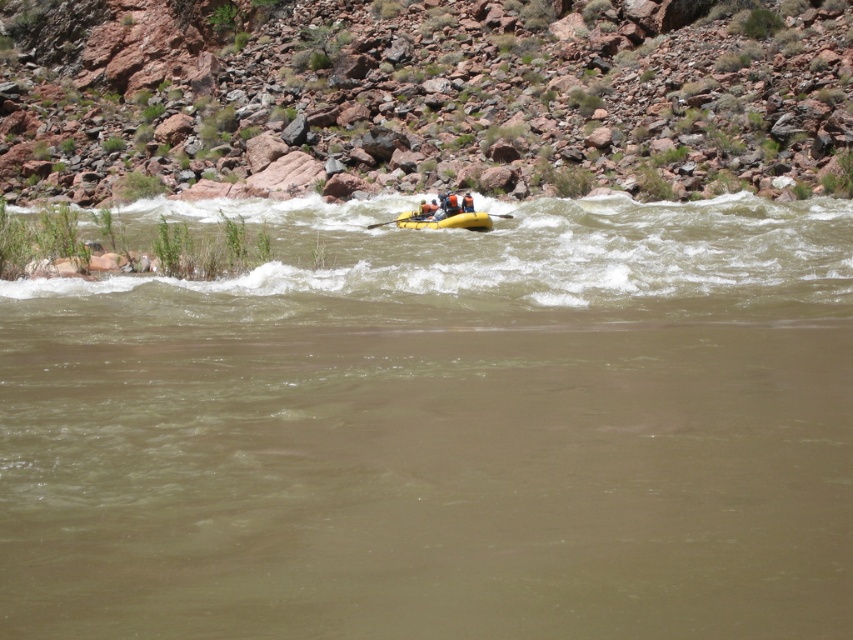
Is the position of yellow rubber boat at center less distant than that of yellow rubber paddle at center?

Yes.

Who is positioned more to the left, yellow rubber boat at center or yellow rubber paddle at center?

From the viewer's perspective, yellow rubber paddle at center appears more on the left side.

Which is in front, point (459, 221) or point (370, 224)?

Point (459, 221) is in front.

Image resolution: width=853 pixels, height=640 pixels. Find the location of `yellow rubber boat at center`. yellow rubber boat at center is located at coordinates (444, 218).

Which is below, brown rubber raft at center or orange life vest at center?

brown rubber raft at center is lower down.

Is point (846, 296) more distant than point (463, 209)?

No, (846, 296) is closer to viewer.

Between point (706, 413) and point (469, 209), which one is positioned in front?

Positioned in front is point (706, 413).

Where is `brown rubber raft at center`? Image resolution: width=853 pixels, height=640 pixels. brown rubber raft at center is located at coordinates (440, 429).

Does rusty rock at center appear over orange life vest at center?

Correct, rusty rock at center is located above orange life vest at center.

Does rusty rock at center have a greater width compared to orange life vest at center?

Indeed, rusty rock at center has a greater width compared to orange life vest at center.

Which is behind, point (3, 35) or point (471, 211)?

Positioned behind is point (3, 35).

Find the location of a particular element. rusty rock at center is located at coordinates (422, 97).